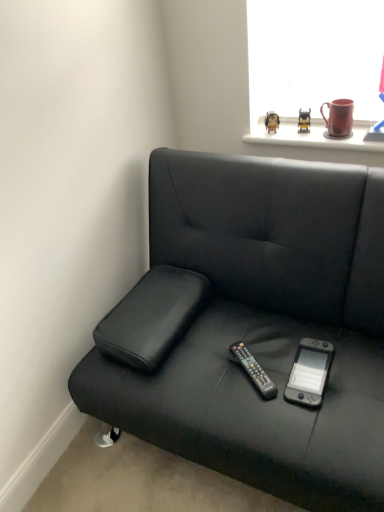
Question: Can you confirm if black plastic remote at center is bigger than black leather studio couch at lower left?

Choices:
 (A) no
 (B) yes

Answer: (A)

Question: From a real-world perspective, is black plastic remote at center positioned under black leather studio couch at lower left based on gravity?

Choices:
 (A) yes
 (B) no

Answer: (A)

Question: Is black plastic remote at center completely or partially outside of black leather studio couch at lower left?

Choices:
 (A) no
 (B) yes

Answer: (A)

Question: Can you confirm if black plastic remote at center is wider than black leather studio couch at lower left?

Choices:
 (A) no
 (B) yes

Answer: (A)

Question: From the image's perspective, is black plastic remote at center located above black leather studio couch at lower left?

Choices:
 (A) yes
 (B) no

Answer: (B)

Question: Can you confirm if black plastic remote at center is smaller than black leather studio couch at lower left?

Choices:
 (A) yes
 (B) no

Answer: (A)

Question: From a real-world perspective, is black plastic remote at center physically below gray matte nintendo switch at center?

Choices:
 (A) yes
 (B) no

Answer: (B)

Question: From a real-world perspective, is black plastic remote at center located higher than gray matte nintendo switch at center?

Choices:
 (A) yes
 (B) no

Answer: (A)

Question: Can you confirm if black plastic remote at center is shorter than gray matte nintendo switch at center?

Choices:
 (A) yes
 (B) no

Answer: (B)

Question: Considering the relative sizes of black plastic remote at center and gray matte nintendo switch at center in the image provided, is black plastic remote at center bigger than gray matte nintendo switch at center?

Choices:
 (A) yes
 (B) no

Answer: (B)

Question: Does black plastic remote at center have a lesser width compared to gray matte nintendo switch at center?

Choices:
 (A) yes
 (B) no

Answer: (A)

Question: Does black plastic remote at center have a smaller size compared to gray matte nintendo switch at center?

Choices:
 (A) yes
 (B) no

Answer: (A)

Question: Is matte black figurine at upper center, positioned as the 1th toy in left-to-right order, wider than black leather studio couch at lower left?

Choices:
 (A) no
 (B) yes

Answer: (A)